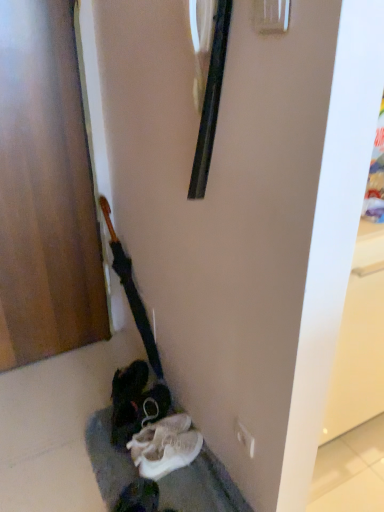
Question: In terms of height, does wooden polished guitar at left look taller or shorter compared to wooden door at left?

Choices:
 (A) short
 (B) tall

Answer: (A)

Question: Is wooden polished guitar at left in front of or behind wooden door at left in the image?

Choices:
 (A) behind
 (B) front

Answer: (A)

Question: Estimate the real-world distances between objects in this image. Which object is farther from the wooden door at left?

Choices:
 (A) wooden polished guitar at left
 (B) white fabric shoe at lower center

Answer: (B)

Question: Which object is the closest to the wooden polished guitar at left?

Choices:
 (A) wooden door at left
 (B) white fabric shoe at lower center

Answer: (A)